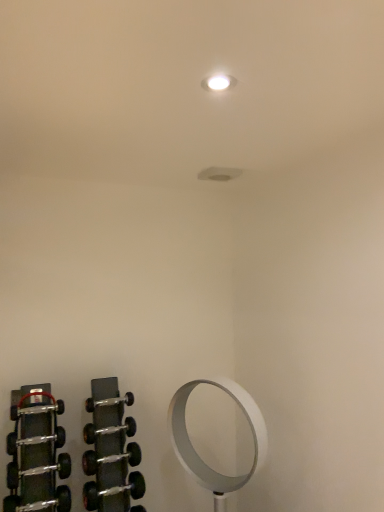
How much space does silver metallic dumbbell at lower left, the fourth dumbbell positioned from the top, occupy horizontally?

silver metallic dumbbell at lower left, the fourth dumbbell positioned from the top, is 3.00 inches wide.

In order to face silver metallic dumbbell at lower left, placed as the 8th dumbbell when sorted from top to bottom, should I rotate leftwards or rightwards?

Rotate your view left by about 10.050°.

At what (x,y) coordinates should I click in order to perform the action: click on white metallic mirror at lower right. Please return your answer as a coordinate pair (x, y). The image size is (384, 512). Looking at the image, I should click on (195, 450).

From a real-world perspective, which is physically above, black rubber dumbbell at left, marked as the sixth dumbbell in a bottom-to-top arrangement, or silver metallic dumbbell at lower left, placed as the 8th dumbbell when sorted from top to bottom?

black rubber dumbbell at left, marked as the sixth dumbbell in a bottom-to-top arrangement, is physically above.

From the image's perspective, between black rubber dumbbell at left, marked as the sixth dumbbell in a bottom-to-top arrangement, and silver metallic dumbbell at lower left, placed as the 8th dumbbell when sorted from top to bottom, who is located below?

From the image's view, silver metallic dumbbell at lower left, placed as the 8th dumbbell when sorted from top to bottom, is below.

Consider the image. Is black rubber dumbbell at left, the third dumbbell positioned from the top, looking in the opposite direction of silver metallic dumbbell at lower left, placed as the 8th dumbbell when sorted from top to bottom?

No, black rubber dumbbell at left, the third dumbbell positioned from the top,'s orientation is not away from silver metallic dumbbell at lower left, placed as the 8th dumbbell when sorted from top to bottom.

Between point (14, 448) and point (123, 490), which one is positioned behind?

Point (123, 490)

From the polished metal dumbbell at left, the 1th dumbbell positioned from the top, count 3rd dumbbells forward and point to it. Please provide its 2D coordinates.

[(38, 470)]

Are polished metal dumbbell at left, the 1th dumbbell positioned from the top, and silver metallic dumbbell at lower left, marked as the 5th dumbbell in a top-to-bottom arrangement, making contact?

polished metal dumbbell at left, the 1th dumbbell positioned from the top, and silver metallic dumbbell at lower left, marked as the 5th dumbbell in a top-to-bottom arrangement, are not in contact.

In terms of height, does polished metal dumbbell at left, the 1th dumbbell positioned from the top, look taller or shorter compared to silver metallic dumbbell at lower left, marked as the 5th dumbbell in a top-to-bottom arrangement?

polished metal dumbbell at left, the 1th dumbbell positioned from the top, is shorter than silver metallic dumbbell at lower left, marked as the 5th dumbbell in a top-to-bottom arrangement.

The width and height of the screenshot is (384, 512). Identify the location of the 1st dumbbell behind the polished metal dumbbell at left, the 1th dumbbell positioned from the top. (110, 458).

Between polished metal dumbbell at left, the eighth dumbbell from the bottom, and silver metallic dumbbell at lower left, which ranks as the 6th dumbbell in top-to-bottom order, which one is positioned behind?

Positioned behind is silver metallic dumbbell at lower left, which ranks as the 6th dumbbell in top-to-bottom order.

Who is taller, polished metal dumbbell at left, the 1th dumbbell positioned from the top, or silver metallic dumbbell at lower left, which ranks as the 6th dumbbell in top-to-bottom order?

Standing taller between the two is silver metallic dumbbell at lower left, which ranks as the 6th dumbbell in top-to-bottom order.

Is polished metal dumbbell at left, the eighth dumbbell from the bottom, completely or partially outside of silver metallic dumbbell at lower left, which ranks as the 6th dumbbell in top-to-bottom order?

Absolutely, polished metal dumbbell at left, the eighth dumbbell from the bottom, is external to silver metallic dumbbell at lower left, which ranks as the 6th dumbbell in top-to-bottom order.

From a real-world perspective, which object stands above the other?

In real-world perspective, black rubber dumbbell at left, the third dumbbell positioned from the top, is above.

Does black rubber dumbbell at left, marked as the sixth dumbbell in a bottom-to-top arrangement, appear on the left side of white metallic mirror at lower right?

Indeed, black rubber dumbbell at left, marked as the sixth dumbbell in a bottom-to-top arrangement, is positioned on the left side of white metallic mirror at lower right.

This screenshot has height=512, width=384. I want to click on the 4th dumbbell above when counting from the white metallic mirror at lower right (from the image's perspective), so click(35, 440).

Considering their positions, is black rubber dumbbell at left, marked as the sixth dumbbell in a bottom-to-top arrangement, located in front of or behind white metallic mirror at lower right?

black rubber dumbbell at left, marked as the sixth dumbbell in a bottom-to-top arrangement, is behind white metallic mirror at lower right.

From a real-world perspective, is silver metallic dumbbell at lower left, which is the third dumbbell in bottom-to-top order, over polished metal dumbbell at left, the 1th dumbbell positioned from the top?

No.

How many degrees apart are the facing directions of silver metallic dumbbell at lower left, which ranks as the 6th dumbbell in top-to-bottom order, and polished metal dumbbell at left, the eighth dumbbell from the bottom?

1.01 degrees separate the facing orientations of silver metallic dumbbell at lower left, which ranks as the 6th dumbbell in top-to-bottom order, and polished metal dumbbell at left, the eighth dumbbell from the bottom.

Based on the photo, between silver metallic dumbbell at lower left, which is the third dumbbell in bottom-to-top order, and polished metal dumbbell at left, the eighth dumbbell from the bottom, which one has less height?

With less height is polished metal dumbbell at left, the eighth dumbbell from the bottom.

From the image's perspective, does silver metallic dumbbell at lower left, which ranks as the 6th dumbbell in top-to-bottom order, appear higher than polished metal dumbbell at left, the 1th dumbbell positioned from the top?

Incorrect, from the image's perspective, silver metallic dumbbell at lower left, which ranks as the 6th dumbbell in top-to-bottom order, is lower than polished metal dumbbell at left, the 1th dumbbell positioned from the top.

Between silver metallic dumbbell at lower left, which is the third dumbbell in bottom-to-top order, and polished silver dumbbell at lower left, the 2th dumbbell when ordered from top to bottom, which one has less height?

polished silver dumbbell at lower left, the 2th dumbbell when ordered from top to bottom, is shorter.

Which is farther, (96, 452) or (87, 404)?

Positioned behind is point (87, 404).

Starting from the silver metallic dumbbell at lower left, which is the third dumbbell in bottom-to-top order, which dumbbell is the 2nd one behind? Please provide its 2D coordinates.

[(109, 402)]

Which object is thinner, silver metallic dumbbell at lower left, the fourth dumbbell positioned from the top, or silver metallic dumbbell at lower left, acting as the fourth dumbbell starting from the bottom?

silver metallic dumbbell at lower left, the fourth dumbbell positioned from the top.

Which dumbbell is the 5th one when counting from the front of the silver metallic dumbbell at lower left, the fourth dumbbell positioned from the top? Please provide its 2D coordinates.

[(38, 470)]

From the image's perspective, would you say silver metallic dumbbell at lower left, placed as the 5th dumbbell when sorted from bottom to top, is positioned over silver metallic dumbbell at lower left, marked as the 5th dumbbell in a top-to-bottom arrangement?

Correct, silver metallic dumbbell at lower left, placed as the 5th dumbbell when sorted from bottom to top, appears higher than silver metallic dumbbell at lower left, marked as the 5th dumbbell in a top-to-bottom arrangement, in the image.

Who is shorter, silver metallic dumbbell at lower left, placed as the 5th dumbbell when sorted from bottom to top, or silver metallic dumbbell at lower left, marked as the 5th dumbbell in a top-to-bottom arrangement?

With less height is silver metallic dumbbell at lower left, placed as the 5th dumbbell when sorted from bottom to top.

From the black rubber dumbbell at left, marked as the sixth dumbbell in a bottom-to-top arrangement, count 6th dumbbell to the right and point to it. Please provide its 2D coordinates.

[(115, 495)]

The image size is (384, 512). Identify the location of the 2nd dumbbell to the left when counting from the silver metallic dumbbell at lower left, marked as the 5th dumbbell in a top-to-bottom arrangement. (37, 408).

Considering their positions, is silver metallic dumbbell at lower left, acting as the fourth dumbbell starting from the bottom, positioned closer to silver metallic dumbbell at lower left, placed as the 8th dumbbell when sorted from top to bottom, than polished silver dumbbell at lower left, the seventh dumbbell in the bottom-to-top sequence?

silver metallic dumbbell at lower left, acting as the fourth dumbbell starting from the bottom, is closer to silver metallic dumbbell at lower left, placed as the 8th dumbbell when sorted from top to bottom.

Estimate the real-world distances between objects in this image. Which object is closer to polished metal dumbbell at left, the 1th dumbbell positioned from the top, white metallic mirror at lower right or silver metallic dumbbell at lower left, placed as the 8th dumbbell when sorted from top to bottom?

silver metallic dumbbell at lower left, placed as the 8th dumbbell when sorted from top to bottom, lies closer to polished metal dumbbell at left, the 1th dumbbell positioned from the top, than the other object.

Based on their spatial positions, is silver metallic dumbbell at lower left, marked as the 5th dumbbell in a top-to-bottom arrangement, or polished metal dumbbell at left, the eighth dumbbell from the bottom, closer to polished silver dumbbell at lower left, the 2th dumbbell when ordered from top to bottom?

polished metal dumbbell at left, the eighth dumbbell from the bottom, is positioned closer to the anchor polished silver dumbbell at lower left, the 2th dumbbell when ordered from top to bottom.

Which object lies nearer to the anchor point polished silver dumbbell at lower left, the 2th dumbbell when ordered from top to bottom, polished metal dumbbell at left, the 1th dumbbell positioned from the top, or black rubber dumbbell at left, the third dumbbell positioned from the top?

Based on the image, polished metal dumbbell at left, the 1th dumbbell positioned from the top, appears to be nearer to polished silver dumbbell at lower left, the 2th dumbbell when ordered from top to bottom.

When comparing their distances from black rubber dumbbell at left, the third dumbbell positioned from the top, does polished metal dumbbell at left, the eighth dumbbell from the bottom, or silver metallic dumbbell at lower left, which is the third dumbbell in bottom-to-top order, seem closer?

The object closer to black rubber dumbbell at left, the third dumbbell positioned from the top, is polished metal dumbbell at left, the eighth dumbbell from the bottom.

Considering their positions, is polished silver dumbbell at lower left, the seventh dumbbell in the bottom-to-top sequence, positioned closer to polished metal dumbbell at left, the 1th dumbbell positioned from the top, than silver metallic dumbbell at lower left, marked as the 5th dumbbell in a top-to-bottom arrangement?

Among the two, silver metallic dumbbell at lower left, marked as the 5th dumbbell in a top-to-bottom arrangement, is located nearer to polished metal dumbbell at left, the 1th dumbbell positioned from the top.

Considering their positions, is silver metallic dumbbell at lower left, placed as the 5th dumbbell when sorted from bottom to top, positioned further to black rubber dumbbell at lower left, the second dumbbell when ordered from bottom to top, than polished silver dumbbell at lower left, the 2th dumbbell when ordered from top to bottom?

polished silver dumbbell at lower left, the 2th dumbbell when ordered from top to bottom, lies further to black rubber dumbbell at lower left, the second dumbbell when ordered from bottom to top, than the other object.

Which object lies nearer to the anchor point silver metallic dumbbell at lower left, placed as the 8th dumbbell when sorted from top to bottom, polished metal dumbbell at left, the eighth dumbbell from the bottom, or black rubber dumbbell at left, marked as the sixth dumbbell in a bottom-to-top arrangement?

black rubber dumbbell at left, marked as the sixth dumbbell in a bottom-to-top arrangement, lies closer to silver metallic dumbbell at lower left, placed as the 8th dumbbell when sorted from top to bottom, than the other object.

Find the location of a particular element. The height and width of the screenshot is (512, 384). dumbbell situated between silver metallic dumbbell at lower left, which is the third dumbbell in bottom-to-top order, and white metallic mirror at lower right from left to right is located at coordinates (115, 495).